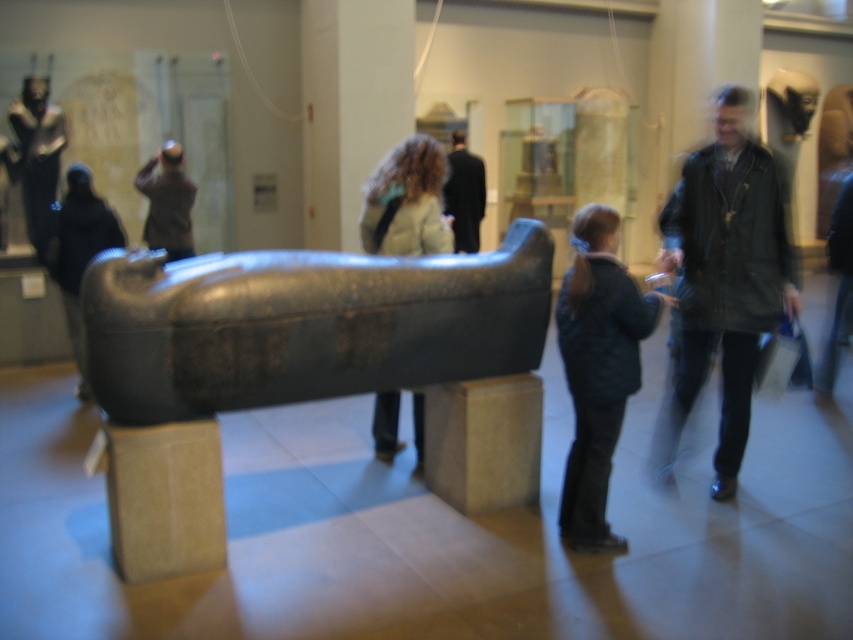
Image resolution: width=853 pixels, height=640 pixels. In order to click on dark blue quilted jacket at center in this screenshot , I will do `click(596, 369)`.

Does dark blue quilted jacket at center have a lesser height compared to light brown leather jacket at center?

In fact, dark blue quilted jacket at center may be taller than light brown leather jacket at center.

Is point (611, 388) closer to viewer compared to point (395, 426)?

Yes.

Image resolution: width=853 pixels, height=640 pixels. What are the coordinates of `dark blue quilted jacket at center` in the screenshot? It's located at (596, 369).

Who is more forward, (602, 296) or (77, 260)?

Positioned in front is point (602, 296).

At what (x,y) coordinates should I click in order to perform the action: click on dark blue quilted jacket at center. Please return your answer as a coordinate pair (x, y). This screenshot has height=640, width=853. Looking at the image, I should click on (596, 369).

Is dark brown leather jacket at right smaller than shiny silver statue at upper left?

Actually, dark brown leather jacket at right might be larger than shiny silver statue at upper left.

Describe the element at coordinates (724, 276) in the screenshot. I see `dark brown leather jacket at right` at that location.

Where is `dark brown leather jacket at right`? This screenshot has width=853, height=640. dark brown leather jacket at right is located at coordinates (724, 276).